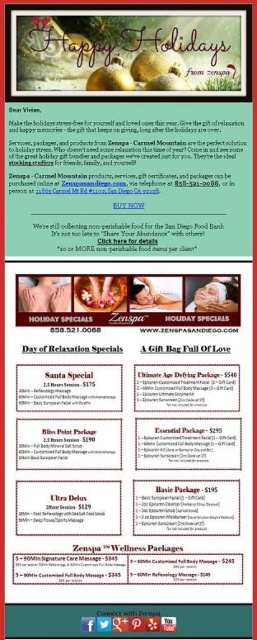
Question: Does matte black package at center come behind matte gold potato at upper center?

Choices:
 (A) no
 (B) yes

Answer: (B)

Question: Can you confirm if matte black package at center is positioned to the right of matte gold potato at upper center?

Choices:
 (A) yes
 (B) no

Answer: (A)

Question: Among these objects, which one is farthest from the camera?

Choices:
 (A) matte gold potato at upper center
 (B) gold shiny ornaments at upper center
 (C) matte black package at center
 (D) matte pink nail polish at center

Answer: (D)

Question: Is white paper at center smaller than matte black gift bag at center?

Choices:
 (A) no
 (B) yes

Answer: (A)

Question: Among these objects, which one is nearest to the camera?

Choices:
 (A) white paper at center
 (B) matte black package at center

Answer: (B)

Question: Which of the following is the farthest from the observer?

Choices:
 (A) white paper at center
 (B) matte pink nail polish at center

Answer: (B)